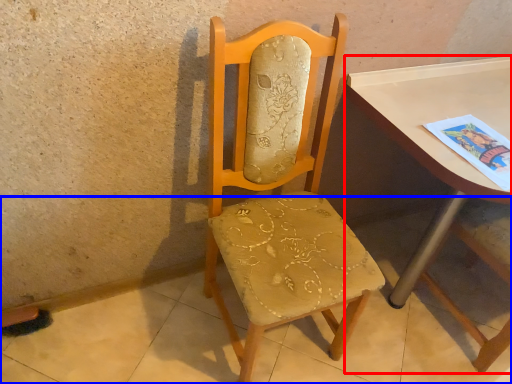
Question: Which point is closer to the camera, table (highlighted by a red box) or concrete (highlighted by a blue box)?

Choices:
 (A) table
 (B) concrete

Answer: (B)